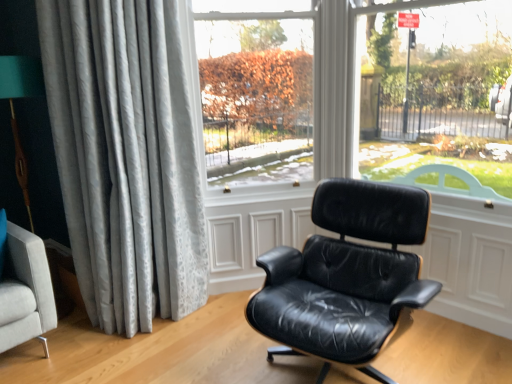
Question: Is point pos(101,39) positioned closer to the camera than point pos(354,251)?

Choices:
 (A) closer
 (B) farther

Answer: (A)

Question: In terms of width, does silvery textured curtain at left look wider or thinner when compared to black leather chair at center?

Choices:
 (A) thin
 (B) wide

Answer: (A)

Question: Considering the real-world distances, which object is closest to the transparent glass window at center?

Choices:
 (A) black leather chair at center
 (B) silvery textured curtain at left

Answer: (B)

Question: Which object is positioned closest to the transparent glass window at center?

Choices:
 (A) silvery textured curtain at left
 (B) black leather chair at center

Answer: (A)